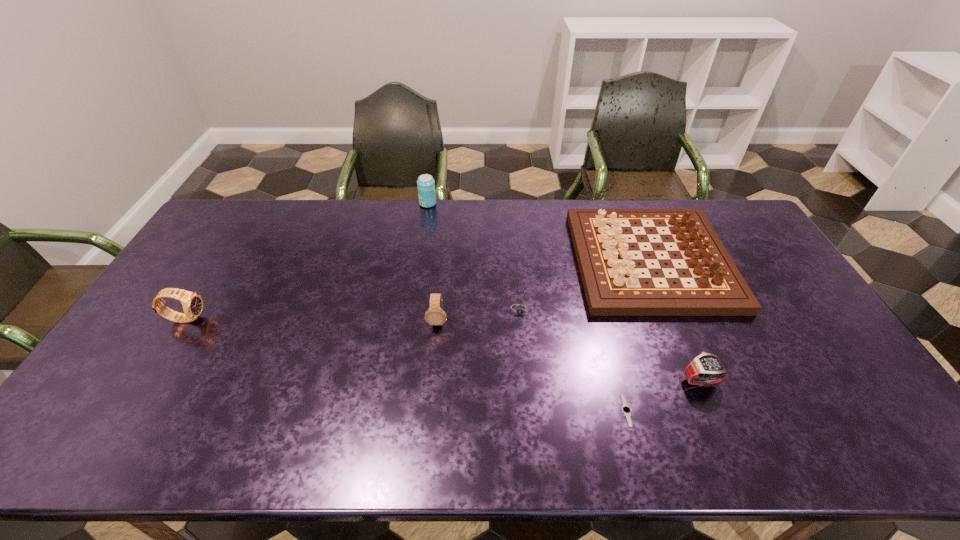
The width and height of the screenshot is (960, 540). In order to click on the shortest object in this screenshot , I will do `click(626, 410)`.

I want to click on vacant space located on the right of the farthest object, so click(503, 204).

Where is `free space located 0.400m on the side with the white pieces of the gameboard`? free space located 0.400m on the side with the white pieces of the gameboard is located at coordinates (457, 261).

Locate an element on the screen. This screenshot has height=540, width=960. free space located on the side with the white pieces of the gameboard is located at coordinates (502, 261).

In order to click on free region located 0.050m on the side with the white pieces of the gameboard in this screenshot , I will do `click(562, 261)`.

What are the coordinates of `free location located on the face of the leftmost object` in the screenshot? It's located at pos(335,318).

What are the coordinates of `blank space located 0.330m on the face of the third object from left to right` in the screenshot? It's located at (427, 442).

At what (x,y) coordinates should I click in order to perform the action: click on vacant space located 0.150m on the back of the third shortest watch. Please return your answer as a coordinate pair (x, y). Image resolution: width=960 pixels, height=540 pixels. Looking at the image, I should click on (677, 325).

Image resolution: width=960 pixels, height=540 pixels. Find the location of `free region located on the face of the fourth object from right to left`. free region located on the face of the fourth object from right to left is located at coordinates (524, 358).

Locate an element on the screen. Image resolution: width=960 pixels, height=540 pixels. free region located 0.210m on the left of the nearest object is located at coordinates (536, 411).